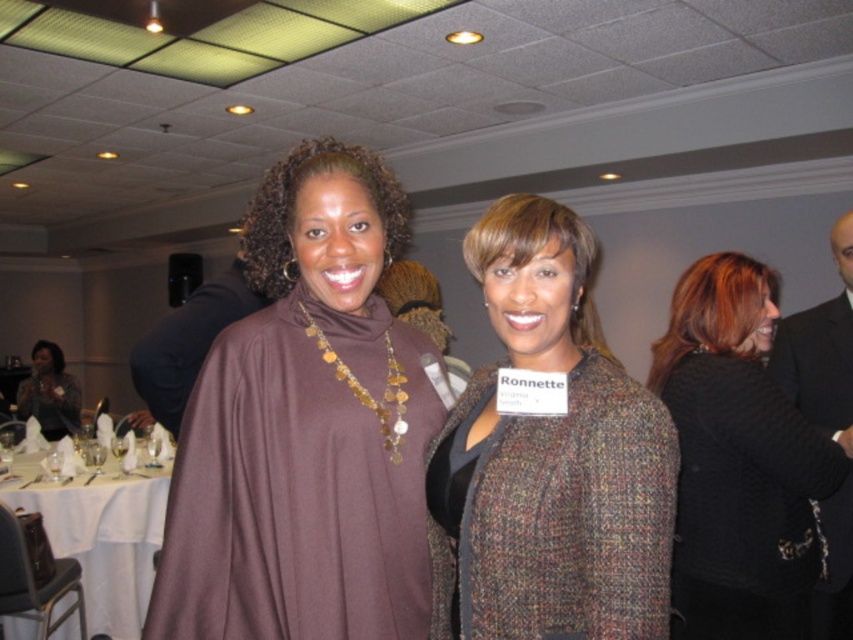
In the scene shown: Which is below, brown matte turtleneck sweater at center or black textured sweater at right?

black textured sweater at right is lower down.

Locate an element on the screen. The width and height of the screenshot is (853, 640). brown matte turtleneck sweater at center is located at coordinates (305, 428).

Locate an element on the screen. brown matte turtleneck sweater at center is located at coordinates (305, 428).

Is multicolored tweed jacket at center behind black textured sweater at right?

No, multicolored tweed jacket at center is closer to the viewer.

Is multicolored tweed jacket at center thinner than black textured sweater at right?

Correct, multicolored tweed jacket at center's width is less than black textured sweater at right's.

Which is behind, point (602, 557) or point (747, 481)?

The point (747, 481) is behind.

In order to click on multicolored tweed jacket at center in this screenshot , I will do `click(549, 458)`.

Is point (144, 595) positioned before point (65, 433)?

Yes, it is.

Does white cloth at lower left appear under matte black dress at left?

Indeed, white cloth at lower left is positioned under matte black dress at left.

Which is in front, point (102, 632) or point (41, 401)?

Point (102, 632) is more forward.

The width and height of the screenshot is (853, 640). Find the location of `white cloth at lower left`. white cloth at lower left is located at coordinates (105, 538).